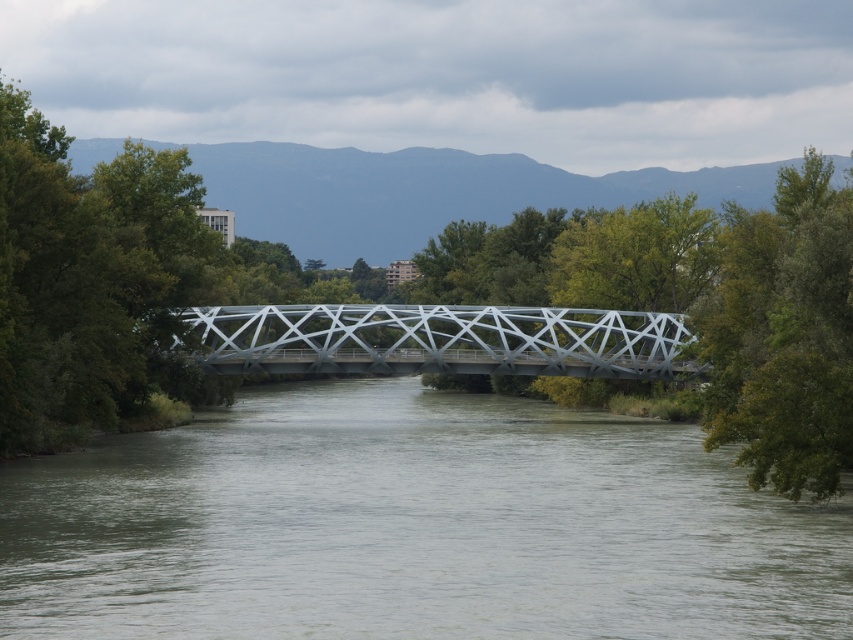
Question: Is greenish-gray water at center positioned behind green leafy tree at right?

Choices:
 (A) no
 (B) yes

Answer: (A)

Question: Which point is farther to the camera?

Choices:
 (A) (224, 349)
 (B) (849, 200)
 (C) (49, 205)
 (D) (289, 397)

Answer: (D)

Question: Does greenish-gray water at center appear on the right side of green leafy tree at right?

Choices:
 (A) no
 (B) yes

Answer: (A)

Question: Which of the following is the closest to the observer?

Choices:
 (A) (397, 508)
 (B) (755, 289)
 (C) (532, 308)
 (D) (85, 422)

Answer: (A)

Question: Which point is farther to the camera?

Choices:
 (A) (201, 250)
 (B) (48, 166)
 (C) (398, 572)

Answer: (A)

Question: Is the position of green leafy tree at left more distant than that of metallic gray bridge at center?

Choices:
 (A) yes
 (B) no

Answer: (B)